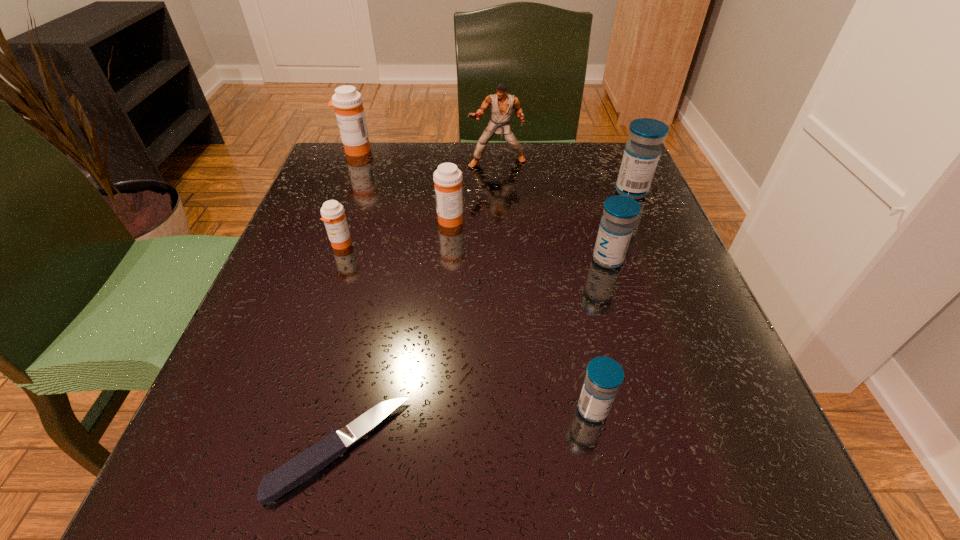
You are a GUI agent. You are given a task and a screenshot of the screen. Output one action in this format:
    pyautogui.click(x=<x>, y=<y>)
    Task: Click on the blue medicine object that ranks as the closest to the rightmost blue medicine
    This screenshot has height=540, width=960.
    Given the screenshot: What is the action you would take?
    pyautogui.click(x=617, y=224)

Select which blue medicine appears as the closest to the sixth object from left to right. Please provide its 2D coordinates. Your answer should be formatted as a tuple, i.e. [(x, y)], where the tuple contains the x and y coordinates of a point satisfying the conditions above.

[(617, 224)]

At what (x,y) coordinates should I click in order to perform the action: click on vacant region that satisfies the following two spatial constraints: 1. on the front-facing side of the fifth object from left to right; 2. on the right side of the third farthest object. Please return your answer as a coordinate pair (x, y). Looking at the image, I should click on (498, 192).

At what (x,y) coordinates should I click in order to perform the action: click on free space that satisfies the following two spatial constraints: 1. on the front side of the steak knife; 2. on the right side of the farthest orange medicine. Please return your answer as a coordinate pair (x, y). This screenshot has height=540, width=960. Looking at the image, I should click on (238, 449).

Locate an element on the screen. vacant region that satisfies the following two spatial constraints: 1. on the front side of the fourth object from left to right; 2. on the right side of the biggest orange medicine is located at coordinates (329, 219).